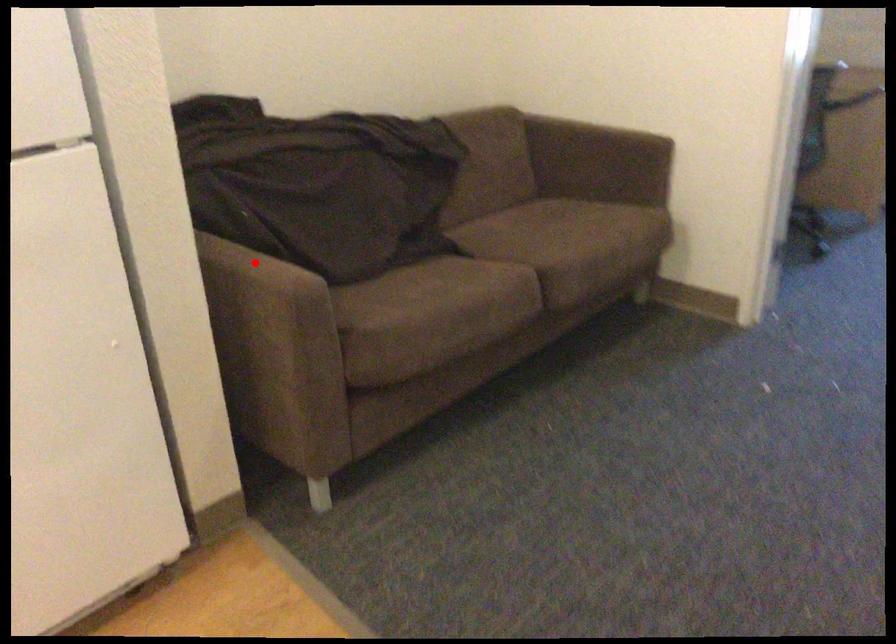
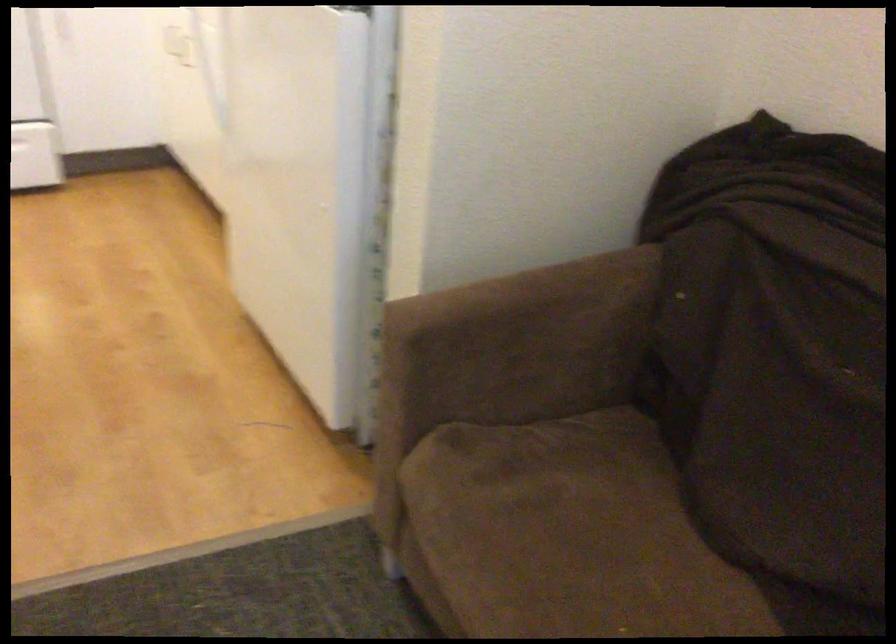
Question: A red point is marked in image1. In image2, is the corresponding 3D point closer to the camera or farther? Reply with the corresponding letter.

Choices:
 (A) The corresponding 3D point is closer.
 (B) The corresponding 3D point is farther.

Answer: (A)